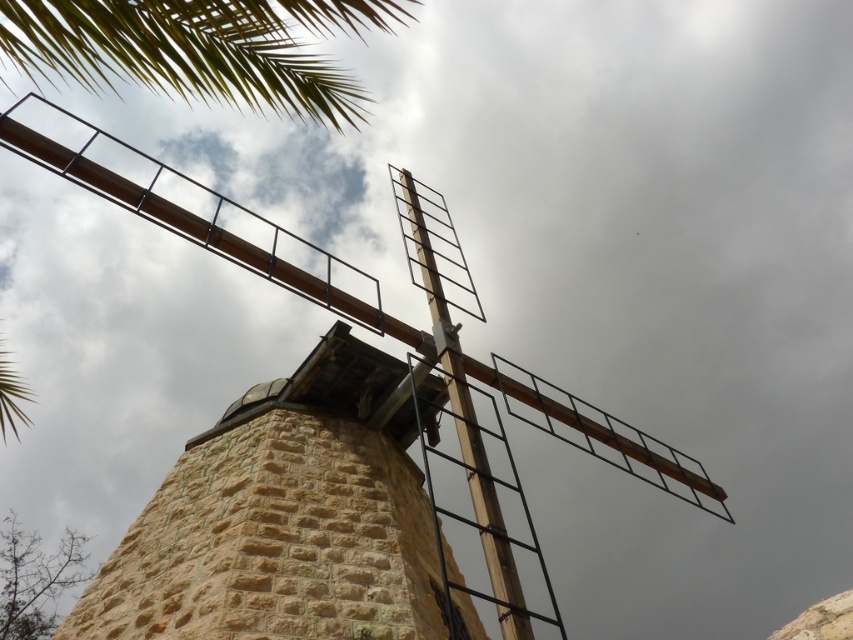
Which is more to the left, stone textured tower at center or wooden windmill at center?

From the viewer's perspective, wooden windmill at center appears more on the left side.

Which is more to the right, stone textured tower at center or wooden windmill at center?

stone textured tower at center

Which is in front, point (397, 497) or point (241, 227)?

Positioned in front is point (397, 497).

Locate an element on the screen. The height and width of the screenshot is (640, 853). stone textured tower at center is located at coordinates (283, 518).

Can you confirm if wooden windmill at center is wider than green leafy palm at upper left?

Correct, the width of wooden windmill at center exceeds that of green leafy palm at upper left.

Is point (583, 429) farther from viewer compared to point (189, 70)?

Yes.

Image resolution: width=853 pixels, height=640 pixels. I want to click on wooden windmill at center, so coord(196,214).

Between stone textured tower at center and green leafy palm at upper left, which one is positioned lower?

stone textured tower at center is lower down.

Does stone textured tower at center have a greater width compared to green leafy palm at upper left?

Incorrect, stone textured tower at center's width does not surpass green leafy palm at upper left's.

Describe the element at coordinates (283, 518) in the screenshot. I see `stone textured tower at center` at that location.

Locate an element on the screen. The width and height of the screenshot is (853, 640). stone textured tower at center is located at coordinates (283, 518).